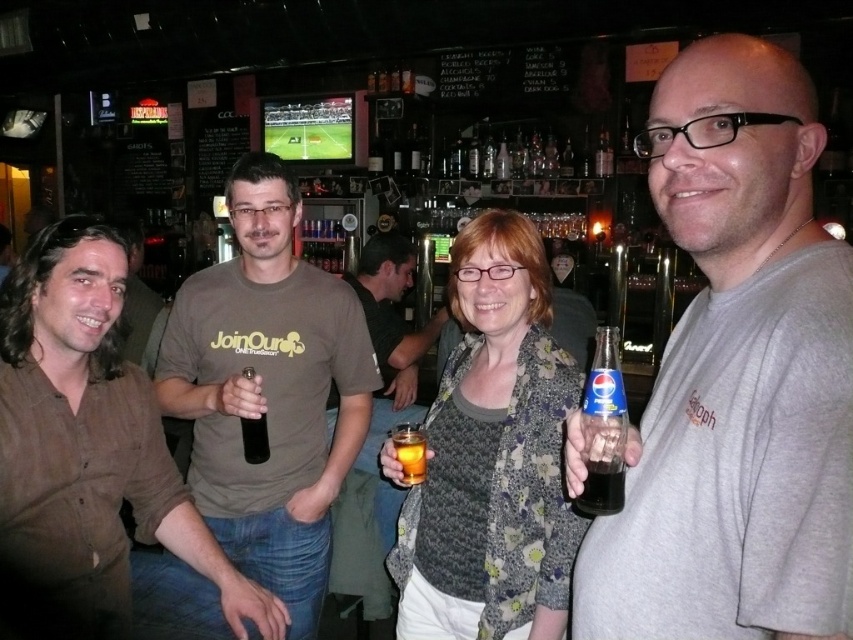
Is brown shirt at left behind floral-patterned sweater at center?

No, brown shirt at left is closer to the viewer.

Can you confirm if brown shirt at left is positioned above floral-patterned sweater at center?

No, brown shirt at left is not above floral-patterned sweater at center.

What do you see at coordinates (90, 442) in the screenshot? I see `brown shirt at left` at bounding box center [90, 442].

You are a GUI agent. You are given a task and a screenshot of the screen. Output one action in this format:
    pyautogui.click(x=<x>, y=<y>)
    Task: Click on the brown shirt at left
    The image size is (853, 640).
    Given the screenshot: What is the action you would take?
    pyautogui.click(x=90, y=442)

Between point (618, 484) and point (138, 356), which one is positioned in front?

Positioned in front is point (618, 484).

Can you confirm if clear glass bottle at right is smaller than brown cotton shirt at left?

Indeed, clear glass bottle at right has a smaller size compared to brown cotton shirt at left.

Describe the element at coordinates (602, 428) in the screenshot. The height and width of the screenshot is (640, 853). I see `clear glass bottle at right` at that location.

What are the coordinates of `clear glass bottle at right` in the screenshot? It's located at (602, 428).

Is dark glass bottle at right in front of translucent glass at center?

Yes, dark glass bottle at right is in front of translucent glass at center.

From the picture: Is dark glass bottle at right smaller than translucent glass at center?

Correct, dark glass bottle at right occupies less space than translucent glass at center.

Between point (618, 468) and point (416, 468), which one is positioned behind?

The point (416, 468) is behind.

You are a GUI agent. You are given a task and a screenshot of the screen. Output one action in this format:
    pyautogui.click(x=<x>, y=<y>)
    Task: Click on the dark glass bottle at right
    The image size is (853, 640).
    Given the screenshot: What is the action you would take?
    pyautogui.click(x=602, y=486)